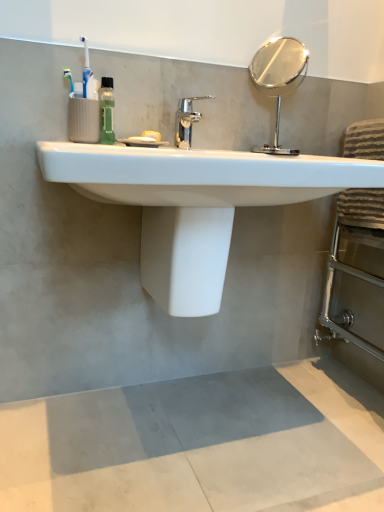
Question: Is polished silver mirror at upper right inside or outside of white glossy sink at center?

Choices:
 (A) outside
 (B) inside

Answer: (A)

Question: Based on their sizes in the image, would you say polished silver mirror at upper right is bigger or smaller than white glossy sink at center?

Choices:
 (A) small
 (B) big

Answer: (A)

Question: Estimate the real-world distances between objects in this image. Which object is closer to the gray concrete mat at lower center?

Choices:
 (A) polished silver mirror at upper right
 (B) white glossy sink at center
 (C) chrome metallic faucet at center
 (D) white glossy toilet bowl at center
 (E) brown striped towel at right

Answer: (D)

Question: Estimate the real-world distances between objects in this image. Which object is closer to the white glossy sink at center?

Choices:
 (A) chrome metallic faucet at center
 (B) white glossy toilet bowl at center
 (C) polished silver mirror at upper right
 (D) gray concrete mat at lower center
 (E) green translucent bottle at upper left

Answer: (B)